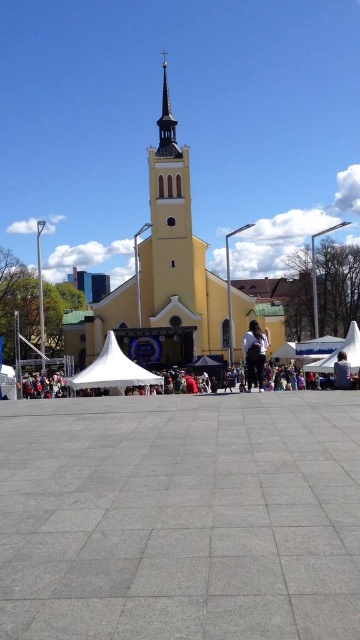
You are planning to set up a small table for a coffee stand in the square. The table requires a space that is at least as wide as the matte black jacket at lower right. Can the white fabric canopy at lower left provide enough width for this requirement?

The white fabric canopy at lower left might be wider than matte black jacket at lower right, so it could potentially provide sufficient width for the table.